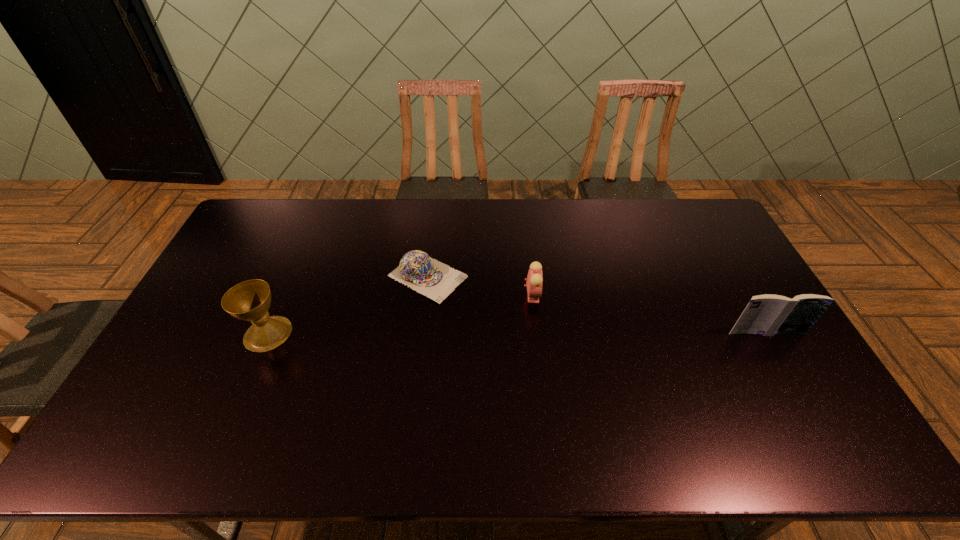
Where is `free spot on the desktop that is between the leftmost object and the book and is positioned on the face of the second object from right to left`? The height and width of the screenshot is (540, 960). free spot on the desktop that is between the leftmost object and the book and is positioned on the face of the second object from right to left is located at coordinates (591, 333).

You are a GUI agent. You are given a task and a screenshot of the screen. Output one action in this format:
    pyautogui.click(x=<x>, y=<y>)
    Task: Click on the free space on the desktop that is between the chalice and the book and is positioned on the front, side, and top of the shortest object
    
    Given the screenshot: What is the action you would take?
    pyautogui.click(x=537, y=333)